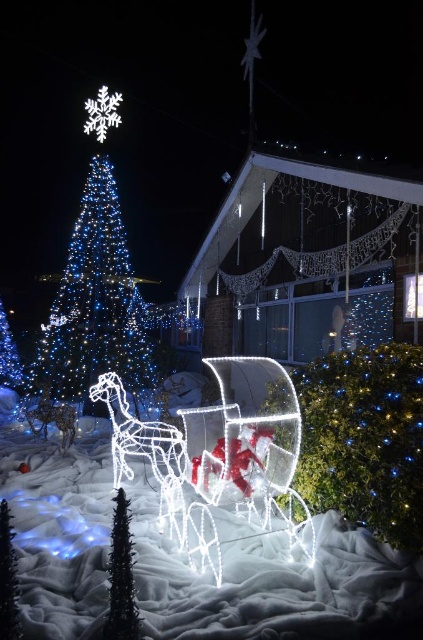
Question: Can you confirm if illuminated plastic tree at upper left is bigger than black matte christmas tree at lower left?

Choices:
 (A) no
 (B) yes

Answer: (B)

Question: Which of the following is the farthest from the observer?

Choices:
 (A) illuminated plastic tree at center
 (B) black matte christmas tree at lower left
 (C) illuminated plastic tree at upper left

Answer: (C)

Question: Which object is closer to the camera taking this photo?

Choices:
 (A) illuminated plastic tree at upper left
 (B) illuminated plastic tree at center

Answer: (B)

Question: Where is illuminated plastic tree at upper left located in relation to black matte christmas tree at lower left in the image?

Choices:
 (A) right
 (B) left

Answer: (B)

Question: Can you confirm if illuminated plastic tree at center is smaller than black matte christmas tree at lower left?

Choices:
 (A) no
 (B) yes

Answer: (A)

Question: Which of the following is the closest to the observer?

Choices:
 (A) illuminated plastic tree at center
 (B) black matte christmas tree at lower left
 (C) illuminated plastic tree at upper left

Answer: (B)